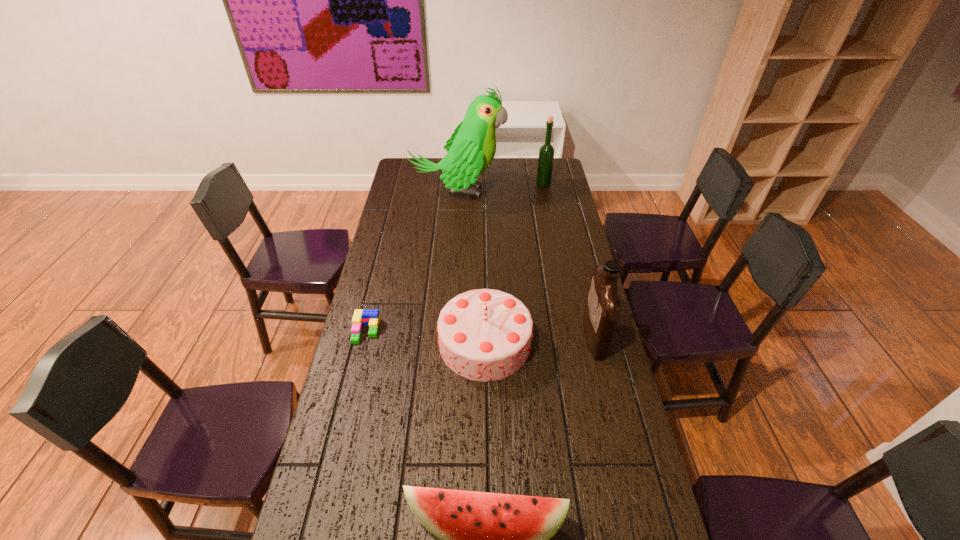
Where is `the tallest object`? the tallest object is located at coordinates (472, 147).

At what (x,y) coordinates should I click in order to perform the action: click on the fifth object from left to right. Please return your answer as a coordinate pair (x, y). The width and height of the screenshot is (960, 540). Looking at the image, I should click on (546, 152).

This screenshot has width=960, height=540. Find the location of `the farther liquor`. the farther liquor is located at coordinates (546, 152).

You are a GUI agent. You are given a task and a screenshot of the screen. Output one action in this format:
    pyautogui.click(x=<x>, y=<y>)
    Task: Click on the nearer liquor
    The width and height of the screenshot is (960, 540).
    Given the screenshot: What is the action you would take?
    pyautogui.click(x=602, y=309)

Where is `the right liquor`? the right liquor is located at coordinates (602, 309).

Locate an element on the screen. The width and height of the screenshot is (960, 540). birthday cake is located at coordinates (485, 335).

The width and height of the screenshot is (960, 540). I want to click on the shortest object, so click(361, 317).

At what (x,y) coordinates should I click in order to perform the action: click on Lego. Please return your answer as a coordinate pair (x, y). Image resolution: width=960 pixels, height=540 pixels. Looking at the image, I should click on (361, 317).

Where is `free space located on the beak of the parakeet`? This screenshot has width=960, height=540. free space located on the beak of the parakeet is located at coordinates 548,192.

You are a GUI agent. You are given a task and a screenshot of the screen. Output one action in this format:
    pyautogui.click(x=<x>, y=<y>)
    Task: Click on the vacant space situated 0.240m on the back of the farther liquor
    Image resolution: width=960 pixels, height=540 pixels.
    Given the screenshot: What is the action you would take?
    pyautogui.click(x=538, y=157)